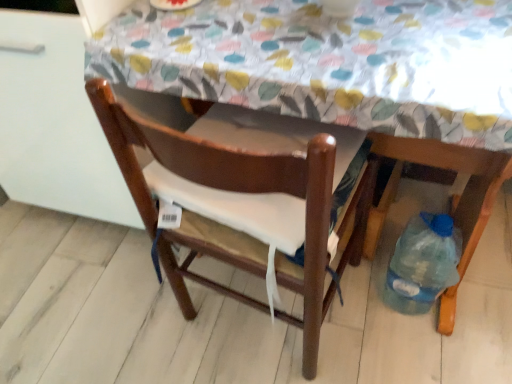
Question: Which direction should I rotate to look at brown wooden chair at center, which is the second chair in right-to-left order?

Choices:
 (A) left
 (B) right

Answer: (A)

Question: Should I look upward or downward to see wooden table at center?

Choices:
 (A) up
 (B) down

Answer: (B)

Question: Is wooden table at center at the right side of translucent plastic bottle at lower right, which appears as the 2th chair when viewed from the left?

Choices:
 (A) yes
 (B) no

Answer: (B)

Question: From the image's perspective, is wooden table at center above translucent plastic bottle at lower right, which ranks as the first chair in right-to-left order?

Choices:
 (A) no
 (B) yes

Answer: (B)

Question: Is wooden table at center next to translucent plastic bottle at lower right, which ranks as the first chair in right-to-left order, and touching it?

Choices:
 (A) yes
 (B) no

Answer: (B)

Question: Does wooden table at center turn towards translucent plastic bottle at lower right, which appears as the 2th chair when viewed from the left?

Choices:
 (A) no
 (B) yes

Answer: (A)

Question: Does wooden table at center have a larger size compared to translucent plastic bottle at lower right, which appears as the 2th chair when viewed from the left?

Choices:
 (A) yes
 (B) no

Answer: (A)

Question: Is wooden table at center not within translucent plastic bottle at lower right, which ranks as the first chair in right-to-left order?

Choices:
 (A) yes
 (B) no

Answer: (A)

Question: Does brown wooden chair at center, which is the second chair in right-to-left order, have a lesser height compared to translucent plastic bottle at lower right, which appears as the 2th chair when viewed from the left?

Choices:
 (A) yes
 (B) no

Answer: (A)

Question: Is brown wooden chair at center, which is the second chair in right-to-left order, facing away from translucent plastic bottle at lower right, which appears as the 2th chair when viewed from the left?

Choices:
 (A) no
 (B) yes

Answer: (A)

Question: Is the position of brown wooden chair at center, which is the second chair in right-to-left order, less distant than that of translucent plastic bottle at lower right, which appears as the 2th chair when viewed from the left?

Choices:
 (A) no
 (B) yes

Answer: (B)

Question: Is brown wooden chair at center, which is the second chair in right-to-left order, taller than translucent plastic bottle at lower right, which ranks as the first chair in right-to-left order?

Choices:
 (A) no
 (B) yes

Answer: (A)

Question: Can we say brown wooden chair at center, which is the 1th chair from left to right, lies outside translucent plastic bottle at lower right, which appears as the 2th chair when viewed from the left?

Choices:
 (A) yes
 (B) no

Answer: (A)

Question: Is brown wooden chair at center, which is the 1th chair from left to right, smaller than translucent plastic bottle at lower right, which ranks as the first chair in right-to-left order?

Choices:
 (A) yes
 (B) no

Answer: (B)

Question: From the image's perspective, does wooden table at center appear higher than brown wooden chair at center, which is the second chair in right-to-left order?

Choices:
 (A) yes
 (B) no

Answer: (A)